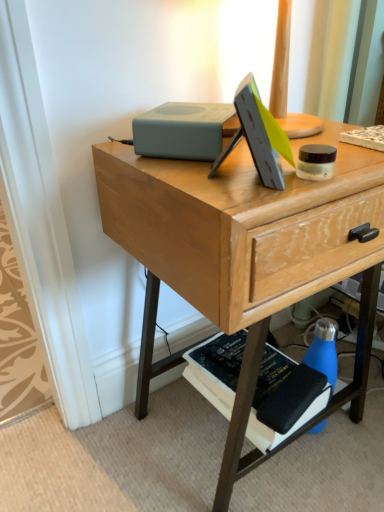
Question: Is blue matte water bottle at lower right outside wooden desk at center?

Choices:
 (A) yes
 (B) no

Answer: (B)

Question: Could you tell me if blue matte water bottle at lower right is facing wooden desk at center?

Choices:
 (A) yes
 (B) no

Answer: (A)

Question: Can you confirm if blue matte water bottle at lower right is wider than wooden desk at center?

Choices:
 (A) no
 (B) yes

Answer: (A)

Question: Is blue matte water bottle at lower right positioned with its back to wooden desk at center?

Choices:
 (A) yes
 (B) no

Answer: (A)

Question: Is blue matte water bottle at lower right shorter than wooden desk at center?

Choices:
 (A) yes
 (B) no

Answer: (A)

Question: Would you say blue matte water bottle at lower right is a long distance from wooden desk at center?

Choices:
 (A) yes
 (B) no

Answer: (B)

Question: Can you confirm if wooden desk at center is thinner than blue matte water bottle at lower right?

Choices:
 (A) no
 (B) yes

Answer: (A)

Question: Is wooden desk at center completely or partially outside of blue matte water bottle at lower right?

Choices:
 (A) yes
 (B) no

Answer: (A)

Question: Is wooden desk at center facing away from blue matte water bottle at lower right?

Choices:
 (A) yes
 (B) no

Answer: (A)

Question: Considering the relative positions of wooden desk at center and blue matte water bottle at lower right in the image provided, is wooden desk at center in front of blue matte water bottle at lower right?

Choices:
 (A) yes
 (B) no

Answer: (A)

Question: From the image's perspective, would you say wooden desk at center is shown under blue matte water bottle at lower right?

Choices:
 (A) no
 (B) yes

Answer: (A)

Question: Does wooden desk at center have a greater width compared to blue matte water bottle at lower right?

Choices:
 (A) yes
 (B) no

Answer: (A)

Question: Does wooden desk at center appear on the right side of hardcover black book at lower right?

Choices:
 (A) no
 (B) yes

Answer: (A)